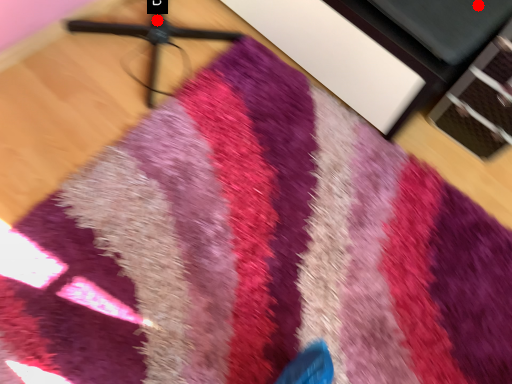
Question: Two points are circled on the image, labeled by A and B beside each circle. Which point is farther from the camera taking this photo?

Choices:
 (A) A is further
 (B) B is further

Answer: (B)